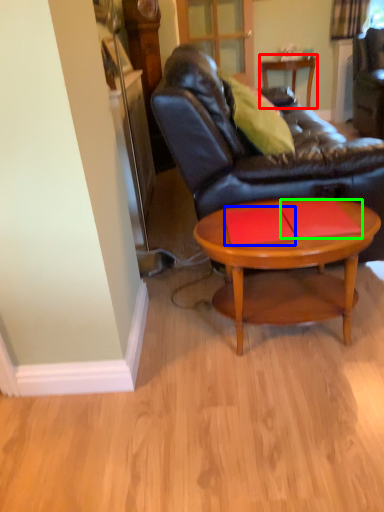
Question: Which object is the closest to the table (highlighted by a red box)? Choose among these: plank (highlighted by a blue box) or plank (highlighted by a green box).

Choices:
 (A) plank
 (B) plank

Answer: (B)